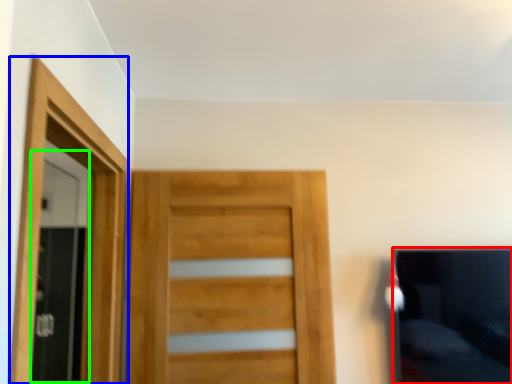
Question: Which is nearer to the couch (highlighted by a red box)? screen door (highlighted by a blue box) or screen door (highlighted by a green box).

Choices:
 (A) screen door
 (B) screen door

Answer: (A)